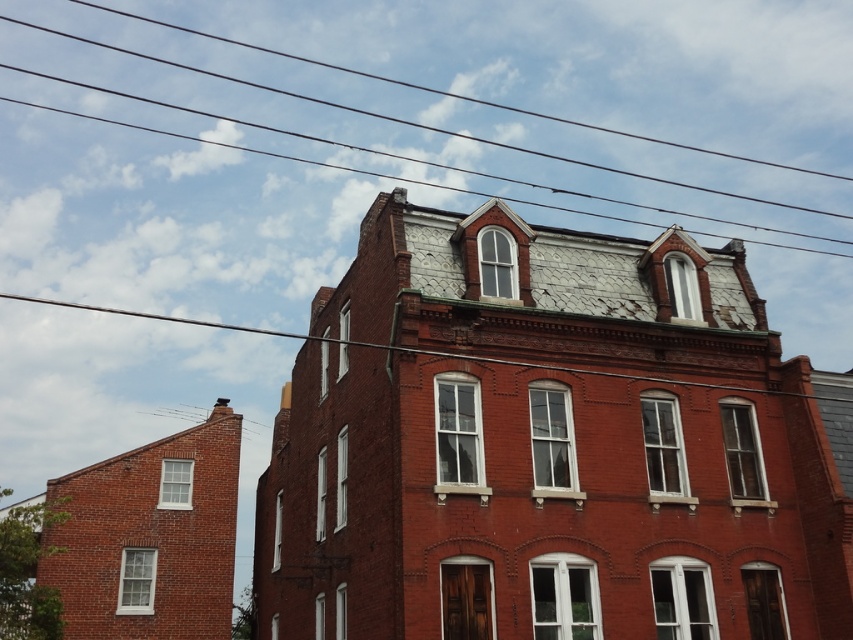
Question: Does black wire at upper center appear on the right side of metallic wire at upper center?

Choices:
 (A) no
 (B) yes

Answer: (B)

Question: Can you confirm if black wire at upper center is positioned to the left of metallic wire at upper center?

Choices:
 (A) no
 (B) yes

Answer: (A)

Question: Which of the following is the farthest from the observer?

Choices:
 (A) (704, 148)
 (B) (219, 326)

Answer: (A)

Question: Is black wire at upper center to the right of metallic wire at upper center from the viewer's perspective?

Choices:
 (A) yes
 (B) no

Answer: (A)

Question: Which point is farther to the camera?

Choices:
 (A) (811, 209)
 (B) (773, 392)

Answer: (A)

Question: Which point is farther to the camera?

Choices:
 (A) black wire at upper center
 (B) metallic wire at upper center

Answer: (A)